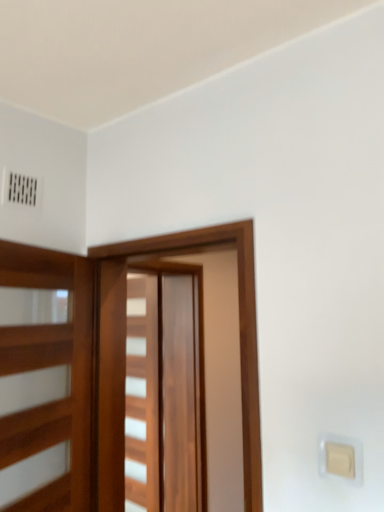
Question: Is wooden barn door at center, the second barn door when ordered from back to front, located outside wooden barn door at center, acting as the second barn door starting from the front?

Choices:
 (A) yes
 (B) no

Answer: (A)

Question: Is wooden barn door at center, which is the 1th barn door from front to back, at the left side of wooden barn door at center, acting as the second barn door starting from the front?

Choices:
 (A) no
 (B) yes

Answer: (A)

Question: Can you confirm if wooden barn door at center, which is the 1th barn door from front to back, is positioned to the right of wooden barn door at center, acting as the second barn door starting from the front?

Choices:
 (A) yes
 (B) no

Answer: (A)

Question: Is wooden barn door at center, the second barn door when ordered from back to front, beside wooden barn door at center, acting as the second barn door starting from the front?

Choices:
 (A) no
 (B) yes

Answer: (A)

Question: Can wooden barn door at center, acting as the second barn door starting from the front, be found inside wooden barn door at center, the second barn door when ordered from back to front?

Choices:
 (A) yes
 (B) no

Answer: (B)

Question: Is wooden barn door at center, the second barn door when ordered from back to front, spatially inside beige plastic light switch at lower right, or outside of it?

Choices:
 (A) inside
 (B) outside

Answer: (B)

Question: Is point (249, 461) positioned closer to the camera than point (336, 450)?

Choices:
 (A) farther
 (B) closer

Answer: (A)

Question: From the image's perspective, is wooden barn door at center, the second barn door when ordered from back to front, above or below beige plastic light switch at lower right?

Choices:
 (A) above
 (B) below

Answer: (A)

Question: Based on their sizes in the image, would you say wooden barn door at center, which is the 1th barn door from front to back, is bigger or smaller than beige plastic light switch at lower right?

Choices:
 (A) big
 (B) small

Answer: (A)

Question: Would you say wooden elevator at left is to the left or to the right of beige plastic light switch at lower right in the picture?

Choices:
 (A) left
 (B) right

Answer: (A)

Question: Is wooden elevator at left taller or shorter than beige plastic light switch at lower right?

Choices:
 (A) short
 (B) tall

Answer: (B)

Question: Is wooden elevator at left in front of or behind beige plastic light switch at lower right in the image?

Choices:
 (A) front
 (B) behind

Answer: (B)

Question: Is wooden elevator at left situated inside beige plastic light switch at lower right or outside?

Choices:
 (A) outside
 (B) inside

Answer: (A)

Question: Based on their sizes in the image, would you say wooden elevator at left is bigger or smaller than wooden barn door at center, which is the 1th barn door in back-to-front order?

Choices:
 (A) big
 (B) small

Answer: (B)

Question: Is point (31, 504) closer or farther from the camera than point (162, 499)?

Choices:
 (A) closer
 (B) farther

Answer: (A)